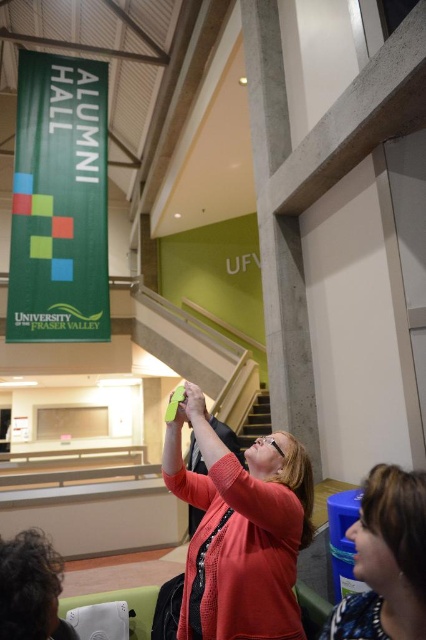
Question: Can you confirm if matte pink sweater at center is thinner than blue plastic water cooler at lower right?

Choices:
 (A) yes
 (B) no

Answer: (B)

Question: Among these objects, which one is nearest to the camera?

Choices:
 (A) blue plastic water cooler at lower right
 (B) matte pink sweater at center

Answer: (A)

Question: From the image, what is the correct spatial relationship of matte pink sweater at center in relation to blue plastic water cooler at lower right?

Choices:
 (A) left
 (B) right

Answer: (A)

Question: Does matte pink sweater at center have a greater width compared to blue plastic water cooler at lower right?

Choices:
 (A) yes
 (B) no

Answer: (A)